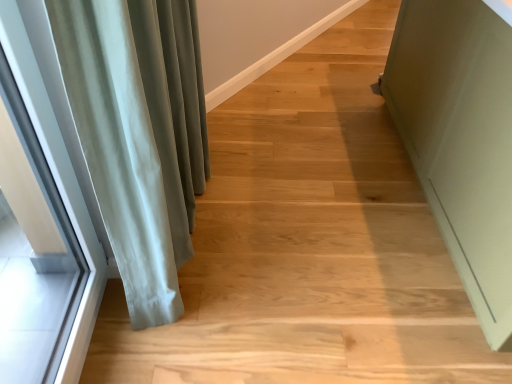
Question: Is satin green curtain at left next to clear glass window at left and touching it?

Choices:
 (A) no
 (B) yes

Answer: (A)

Question: Considering the relative sizes of satin green curtain at left and clear glass window at left in the image provided, is satin green curtain at left bigger than clear glass window at left?

Choices:
 (A) no
 (B) yes

Answer: (B)

Question: Is satin green curtain at left in front of clear glass window at left?

Choices:
 (A) yes
 (B) no

Answer: (B)

Question: Can you confirm if satin green curtain at left is positioned to the left of clear glass window at left?

Choices:
 (A) yes
 (B) no

Answer: (B)

Question: Does satin green curtain at left appear on the right side of clear glass window at left?

Choices:
 (A) yes
 (B) no

Answer: (A)

Question: Would you say clear glass window at left is to the left or to the right of satin green curtain at left in the picture?

Choices:
 (A) right
 (B) left

Answer: (B)

Question: Is clear glass window at left bigger or smaller than satin green curtain at left?

Choices:
 (A) big
 (B) small

Answer: (B)

Question: Considering the positions of clear glass window at left and satin green curtain at left in the image, is clear glass window at left wider or thinner than satin green curtain at left?

Choices:
 (A) thin
 (B) wide

Answer: (A)

Question: Is clear glass window at left spatially inside satin green curtain at left, or outside of it?

Choices:
 (A) inside
 (B) outside

Answer: (B)

Question: Choose the correct answer: Is clear glass window at left inside matte green cabinet at right or outside it?

Choices:
 (A) inside
 (B) outside

Answer: (B)

Question: Considering the positions of clear glass window at left and matte green cabinet at right in the image, is clear glass window at left taller or shorter than matte green cabinet at right?

Choices:
 (A) short
 (B) tall

Answer: (B)

Question: From the image's perspective, is clear glass window at left located above or below matte green cabinet at right?

Choices:
 (A) above
 (B) below

Answer: (B)

Question: Looking at their shapes, would you say clear glass window at left is wider or thinner than matte green cabinet at right?

Choices:
 (A) wide
 (B) thin

Answer: (B)

Question: Is matte green cabinet at right in front of or behind clear glass window at left in the image?

Choices:
 (A) front
 (B) behind

Answer: (B)

Question: In terms of width, does matte green cabinet at right look wider or thinner when compared to clear glass window at left?

Choices:
 (A) thin
 (B) wide

Answer: (B)